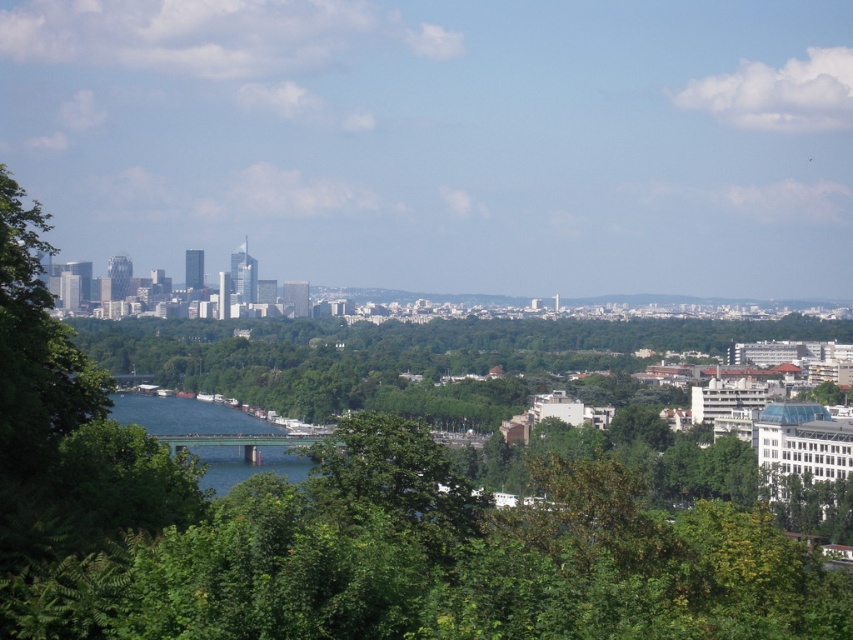
Who is lower down, green leafy trees at center or blue glassy water at center?

blue glassy water at center

Is green leafy trees at center to the left of blue glassy water at center from the viewer's perspective?

In fact, green leafy trees at center is to the right of blue glassy water at center.

Is point (219, 360) positioned behind point (126, 406)?

No, it is not.

At what (x,y) coordinates should I click in order to perform the action: click on green leafy trees at center. Please return your answer as a coordinate pair (x, y). Image resolution: width=853 pixels, height=640 pixels. Looking at the image, I should click on 416,358.